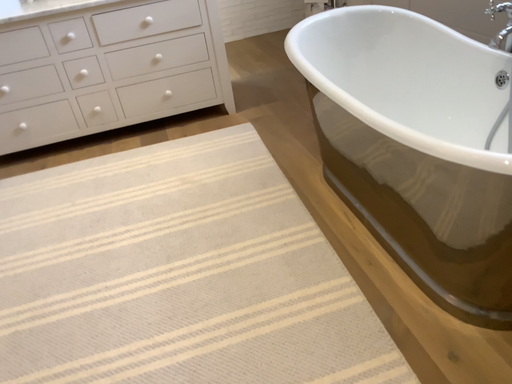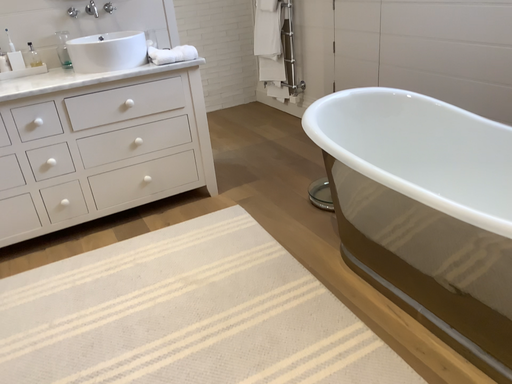
Question: How did the camera likely rotate when shooting the video?

Choices:
 (A) rotated downward
 (B) rotated upward

Answer: (B)